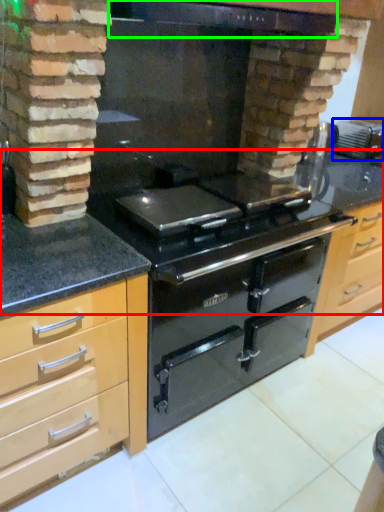
Question: Based on their relative distances, which object is farther from counter top (highlighted by a red box)? Choose from appliance (highlighted by a blue box) and exhaust hood (highlighted by a green box).

Choices:
 (A) appliance
 (B) exhaust hood

Answer: (A)